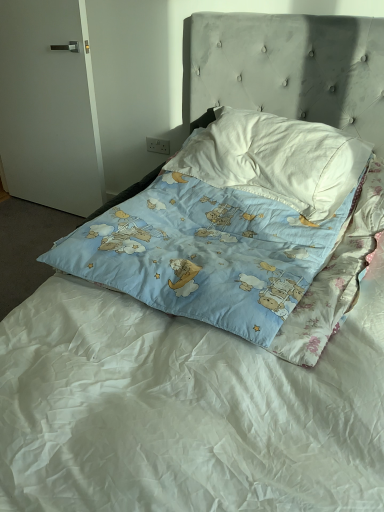
Question: Based on their sizes in the image, would you say blue cotton pillow at center, which ranks as the first pillow in bottom-to-top order, is bigger or smaller than white matte door at left?

Choices:
 (A) small
 (B) big

Answer: (B)

Question: Visually, is blue cotton pillow at center, which ranks as the first pillow in bottom-to-top order, positioned to the left or to the right of white matte door at left?

Choices:
 (A) right
 (B) left

Answer: (A)

Question: Which of these objects is positioned farthest from the white matte door at left?

Choices:
 (A) blue cotton pillow at center, which ranks as the first pillow in bottom-to-top order
 (B) white cotton pillow at upper center, the first pillow when ordered from top to bottom

Answer: (A)

Question: Estimate the real-world distances between objects in this image. Which object is closer to the white matte door at left?

Choices:
 (A) blue cotton pillow at center, which ranks as the first pillow in bottom-to-top order
 (B) white cotton pillow at upper center, positioned as the 2th pillow in bottom-to-top order

Answer: (B)